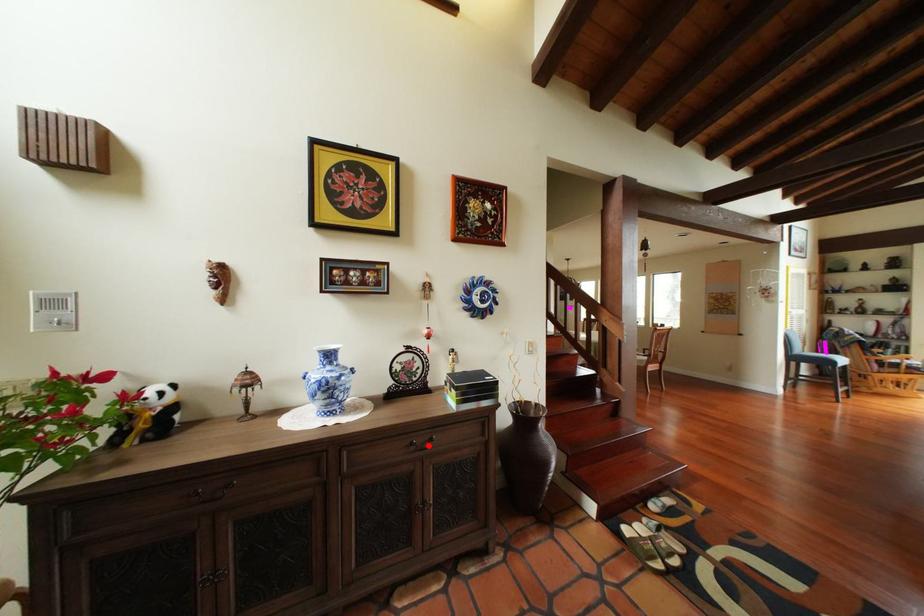
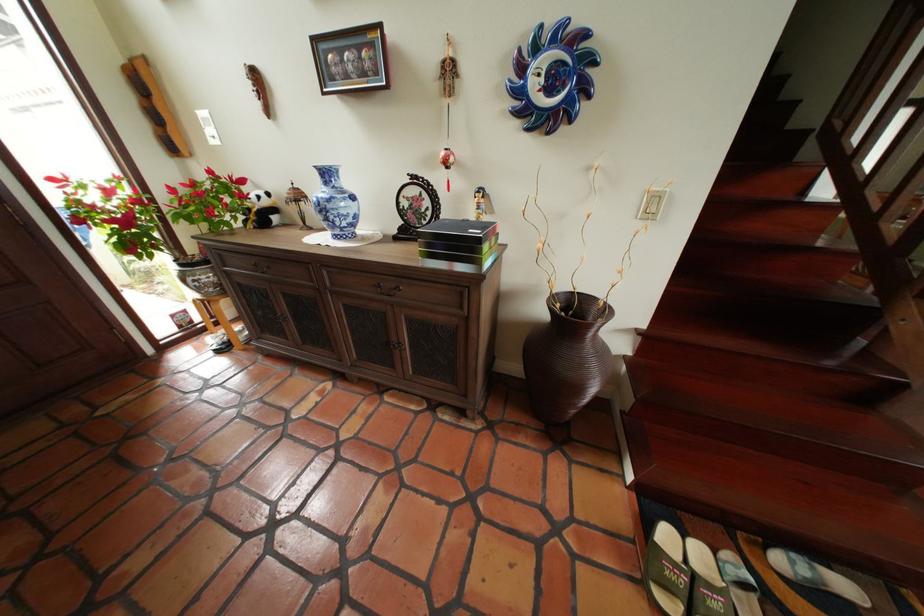
Where in the second image is the point corresponding to the highlighted location from the first image?

(393, 288)